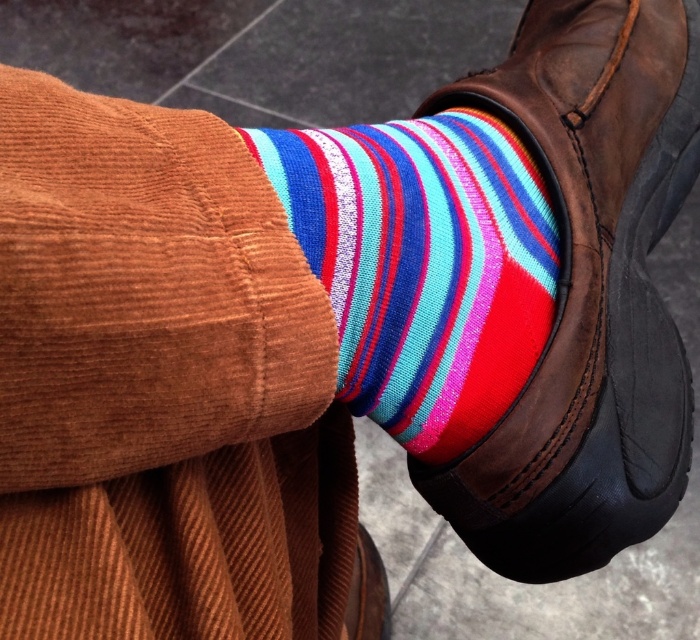
Does multicolored striped sock at center come behind leather boot at center?

That is False.

Who is higher up, multicolored striped sock at center or leather boot at center?

leather boot at center is higher up.

The height and width of the screenshot is (640, 700). Find the location of `multicolored striped sock at center`. multicolored striped sock at center is located at coordinates pos(162,387).

Is multicolored striped sock at center thinner than multicolored knitted sock at center?

Yes.

Is multicolored striped sock at center smaller than multicolored knitted sock at center?

Actually, multicolored striped sock at center might be larger than multicolored knitted sock at center.

Does point (252, 177) come behind point (518, 266)?

No, it is not.

Locate an element on the screen. This screenshot has height=640, width=700. multicolored striped sock at center is located at coordinates (162, 387).

Measure the distance between point (421, 484) and camera.

Point (421, 484) is 20.36 inches away from camera.

Looking at this image, can you confirm if leather boot at center is taller than multicolored knitted sock at center?

Indeed, leather boot at center has a greater height compared to multicolored knitted sock at center.

Who is more distant from viewer, (x=662, y=221) or (x=494, y=280)?

Point (x=662, y=221)

Where is `leather boot at center`? The width and height of the screenshot is (700, 640). leather boot at center is located at coordinates (588, 291).